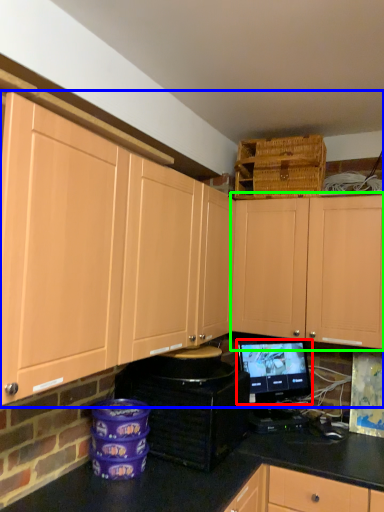
Question: Which is nearer to the computer monitor (highlighted by a red box)? cabinetry (highlighted by a blue box) or cabinetry (highlighted by a green box).

Choices:
 (A) cabinetry
 (B) cabinetry

Answer: (B)